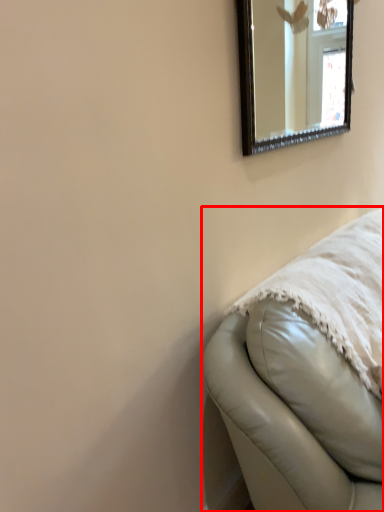
Question: From the image's perspective, what is the correct spatial positioning of furniture (annotated by the red box) in reference to mirror?

Choices:
 (A) above
 (B) below

Answer: (B)